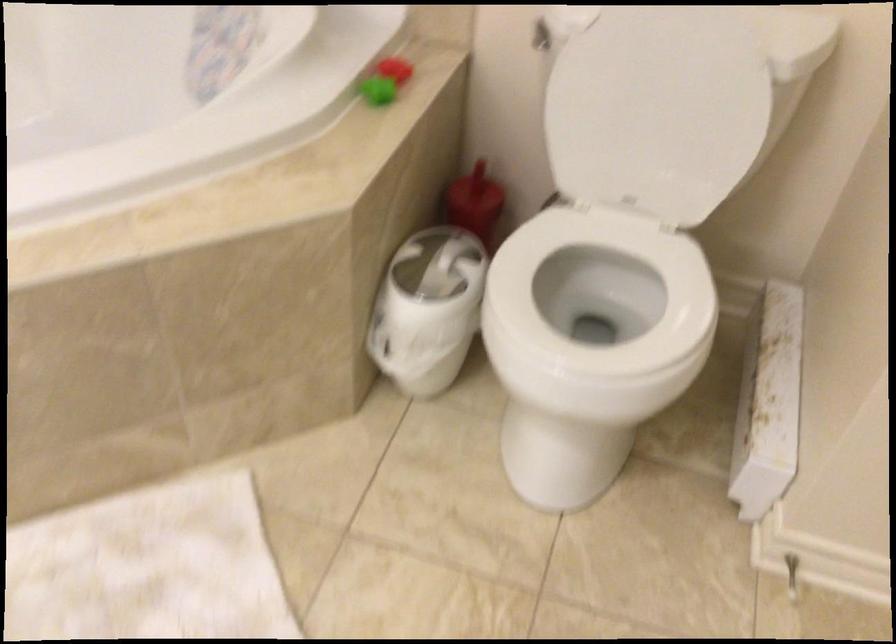
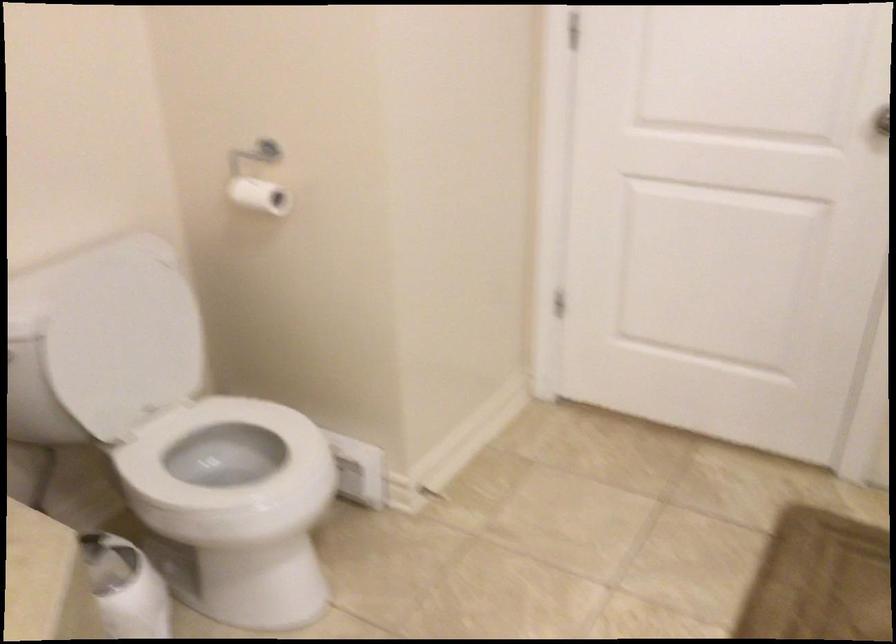
In the second image, find the point that corresponds to the point at 653,308 in the first image.

(226, 453)